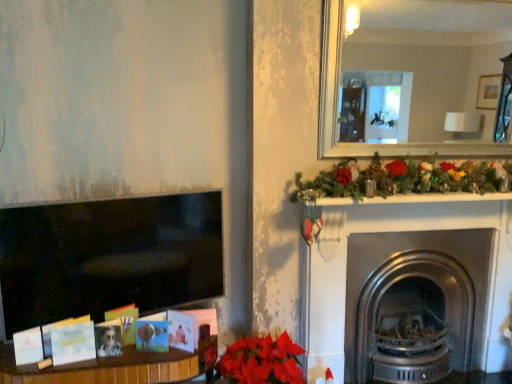
What do you see at coordinates (261, 361) in the screenshot?
I see `vibrant matte poinsettia at lower center` at bounding box center [261, 361].

You are a GUI agent. You are given a task and a screenshot of the screen. Output one action in this format:
    pyautogui.click(x=<x>, y=<y>)
    Task: Click on the vibrant matte poinsettia at lower center
    
    Given the screenshot: What is the action you would take?
    pyautogui.click(x=261, y=361)

At what (x,y) coordinates should I click in order to perform the action: click on stainless steel fireplace at right. Please return your answer as a coordinate pair (x, y). Looking at the image, I should click on (398, 231).

Describe the element at coordinates (398, 231) in the screenshot. I see `stainless steel fireplace at right` at that location.

The height and width of the screenshot is (384, 512). Identify the location of vibrant matte poinsettia at lower center. (261, 361).

Does stainless steel fireplace at right appear on the right side of vibrant matte poinsettia at lower center?

Yes.

Is stainless steel fireplace at right further to the viewer compared to vibrant matte poinsettia at lower center?

That is True.

Does point (342, 248) lie behind point (263, 361)?

Yes.

From the image's perspective, which object appears higher, stainless steel fireplace at right or vibrant matte poinsettia at lower center?

stainless steel fireplace at right is shown above in the image.

From a real-world perspective, is stainless steel fireplace at right under vibrant matte poinsettia at lower center?

Actually, stainless steel fireplace at right is physically above vibrant matte poinsettia at lower center in the real world.

Between stainless steel fireplace at right and vibrant matte poinsettia at lower center, which one has smaller width?

Thinner between the two is stainless steel fireplace at right.

Based on the photo, who is taller, stainless steel fireplace at right or vibrant matte poinsettia at lower center?

stainless steel fireplace at right.

Does stainless steel fireplace at right have a larger size compared to vibrant matte poinsettia at lower center?

Yes, stainless steel fireplace at right is bigger than vibrant matte poinsettia at lower center.

Can vibrant matte poinsettia at lower center be found inside stainless steel fireplace at right?

Actually, vibrant matte poinsettia at lower center is outside stainless steel fireplace at right.

Are stainless steel fireplace at right and vibrant matte poinsettia at lower center located far from each other?

That's not correct — stainless steel fireplace at right is a little close to vibrant matte poinsettia at lower center.

Is stainless steel fireplace at right aimed at vibrant matte poinsettia at lower center?

No, stainless steel fireplace at right is not facing towards vibrant matte poinsettia at lower center.

What's the angular difference between stainless steel fireplace at right and vibrant matte poinsettia at lower center's facing directions?

The angular difference between stainless steel fireplace at right and vibrant matte poinsettia at lower center is 0.00124 degrees.

This screenshot has width=512, height=384. What are the coordinates of `fireplace located behind the vibrant matte poinsettia at lower center` in the screenshot? It's located at (398, 231).

Considering the relative positions of vibrant matte poinsettia at lower center and stainless steel fireplace at right in the image provided, is vibrant matte poinsettia at lower center to the left or to the right of stainless steel fireplace at right?

In the image, vibrant matte poinsettia at lower center appears on the left side of stainless steel fireplace at right.

Which object is closer to the camera taking this photo, vibrant matte poinsettia at lower center or stainless steel fireplace at right?

vibrant matte poinsettia at lower center is closer to the camera.

Does point (283, 377) lie in front of point (378, 219)?

Yes, point (283, 377) is in front of point (378, 219).

From the image's perspective, does vibrant matte poinsettia at lower center appear higher than stainless steel fireplace at right?

No, from the image's perspective, vibrant matte poinsettia at lower center is not on top of stainless steel fireplace at right.

From a real-world perspective, who is located higher, vibrant matte poinsettia at lower center or stainless steel fireplace at right?

Result: In real-world perspective, stainless steel fireplace at right is above.

Is vibrant matte poinsettia at lower center thinner than stainless steel fireplace at right?

In fact, vibrant matte poinsettia at lower center might be wider than stainless steel fireplace at right.

Consider the image. Considering the relative sizes of vibrant matte poinsettia at lower center and stainless steel fireplace at right in the image provided, is vibrant matte poinsettia at lower center shorter than stainless steel fireplace at right?

Correct, vibrant matte poinsettia at lower center is not as tall as stainless steel fireplace at right.

Considering the sizes of vibrant matte poinsettia at lower center and stainless steel fireplace at right in the image, is vibrant matte poinsettia at lower center bigger or smaller than stainless steel fireplace at right?

vibrant matte poinsettia at lower center is smaller than stainless steel fireplace at right.

Is vibrant matte poinsettia at lower center outside of stainless steel fireplace at right?

Yes, vibrant matte poinsettia at lower center is located beyond the bounds of stainless steel fireplace at right.

Does vibrant matte poinsettia at lower center touch stainless steel fireplace at right?

No, vibrant matte poinsettia at lower center is not touching stainless steel fireplace at right.

In the scene shown: Does vibrant matte poinsettia at lower center turn towards stainless steel fireplace at right?

No, vibrant matte poinsettia at lower center does not turn towards stainless steel fireplace at right.

Find the location of a particular element. The height and width of the screenshot is (384, 512). flower in front of the stainless steel fireplace at right is located at coordinates (261, 361).

The image size is (512, 384). Find the location of `fireplace above the vibrant matte poinsettia at lower center (from a real-world perspective)`. fireplace above the vibrant matte poinsettia at lower center (from a real-world perspective) is located at coordinates (398, 231).

Locate an element on the screen. This screenshot has height=384, width=512. flower in front of the stainless steel fireplace at right is located at coordinates (261, 361).